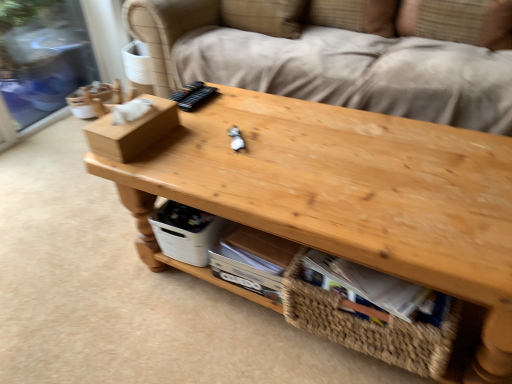
Where is `vacant space to the left of natural wood table at center`? This screenshot has height=384, width=512. vacant space to the left of natural wood table at center is located at coordinates (106, 306).